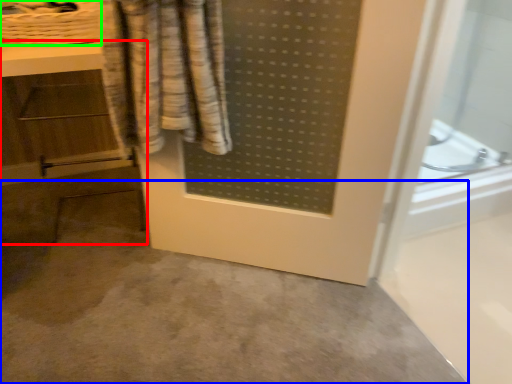
Question: Based on their relative distances, which object is farther from vanity (highlighted by a red box)? Choose from concrete (highlighted by a blue box) and basket (highlighted by a green box).

Choices:
 (A) concrete
 (B) basket

Answer: (A)